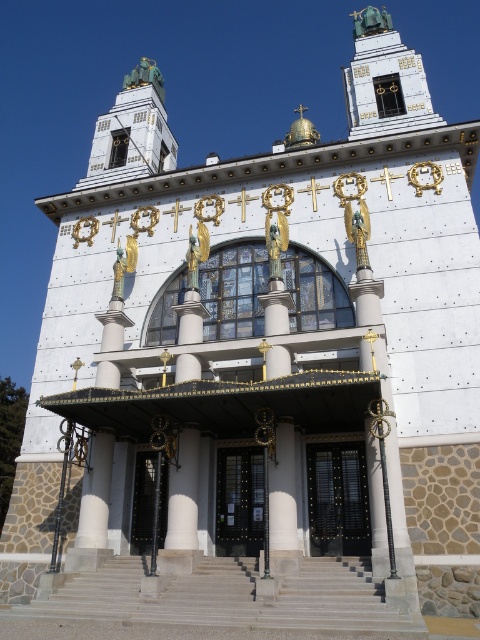
Can you confirm if black metal gate at center is taller than black glass door at center?

No.

At what (x,y) coordinates should I click in order to perform the action: click on black metal gate at center. Please return your answer as a coordinate pair (x, y). This screenshot has width=480, height=640. Looking at the image, I should click on (337, 499).

In order to click on polished bronze spire at upper center in this screenshot , I will do `click(384, 81)`.

Is polished bronze spire at upper center bigger than black metal door at center?

Yes.

Does point (383, 8) come closer to viewer compared to point (217, 497)?

No.

In order to click on polished bronze spire at upper center in this screenshot , I will do `click(384, 81)`.

Which is behind, point (295, 564) or point (166, 477)?

Point (166, 477)

Is white stone pillar at center to the left of black glass door at center from the viewer's perspective?

Incorrect, white stone pillar at center is not on the left side of black glass door at center.

At what (x,y) coordinates should I click in order to perform the action: click on white stone pillar at center. Please return your answer as a coordinate pair (x, y). Looking at the image, I should click on (283, 504).